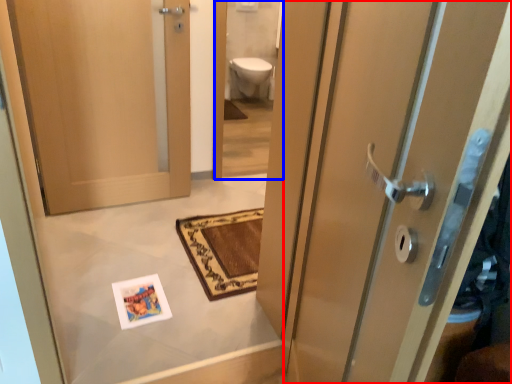
Question: Which object appears farthest to the camera in this image, door (highlighted by a red box) or mirror (highlighted by a blue box)?

Choices:
 (A) door
 (B) mirror

Answer: (B)